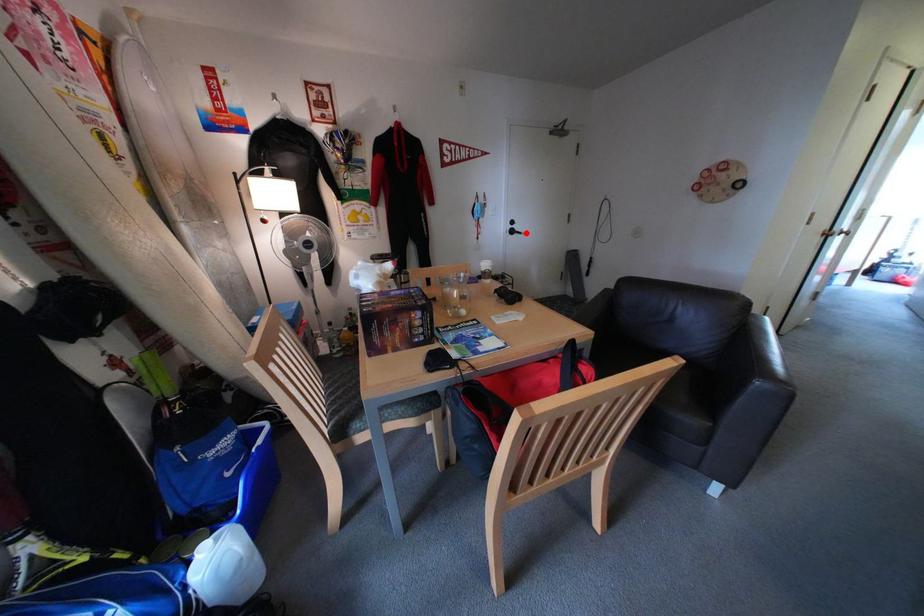
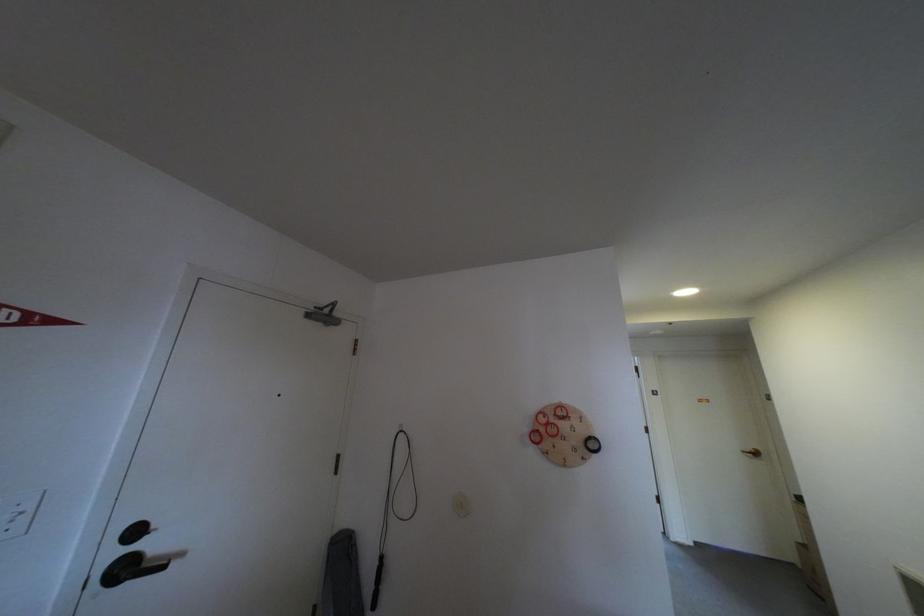
Where in the second image is the point corresponding to the highlighted location from the first image?

(140, 570)